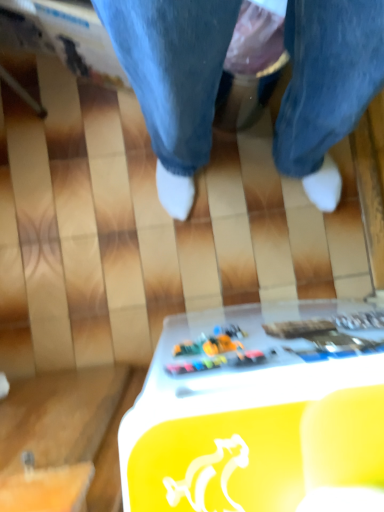
Question: From a real-world perspective, is white plastic table at lower center positioned under metallic gold text at lower center, which is counted as the 2th writing, starting from the left, based on gravity?

Choices:
 (A) no
 (B) yes

Answer: (B)

Question: Can you confirm if white plastic table at lower center is bigger than metallic gold text at lower center, which is counted as the 2th writing, starting from the left?

Choices:
 (A) no
 (B) yes

Answer: (B)

Question: Can you confirm if white plastic table at lower center is taller than metallic gold text at lower center, which is counted as the 2th writing, starting from the left?

Choices:
 (A) no
 (B) yes

Answer: (B)

Question: Does white plastic table at lower center have a lesser width compared to metallic gold text at lower center, which is counted as the 2th writing, starting from the left?

Choices:
 (A) no
 (B) yes

Answer: (A)

Question: Is white plastic table at lower center with metallic gold text at lower center, which is counted as the 2th writing, starting from the left?

Choices:
 (A) no
 (B) yes

Answer: (A)

Question: From a real-world perspective, relative to multicolored plastic toy at center, the second writing from the right, is metallic gold text at lower center, which appears as the first writing when viewed from the right, vertically above or below?

Choices:
 (A) above
 (B) below

Answer: (B)

Question: From the image's perspective, is metallic gold text at lower center, which is counted as the 2th writing, starting from the left, located above or below multicolored plastic toy at center, the second writing from the right?

Choices:
 (A) below
 (B) above

Answer: (B)

Question: Is metallic gold text at lower center, which is counted as the 2th writing, starting from the left, situated inside multicolored plastic toy at center, the second writing from the right, or outside?

Choices:
 (A) outside
 (B) inside

Answer: (B)

Question: Considering their positions, is metallic gold text at lower center, which appears as the first writing when viewed from the right, located in front of or behind multicolored plastic toy at center, which is the 1th writing from left to right?

Choices:
 (A) behind
 (B) front

Answer: (A)

Question: Do you think white plastic table at lower center is within metallic gold text at lower center, which is counted as the 2th writing, starting from the left, or outside of it?

Choices:
 (A) outside
 (B) inside

Answer: (A)

Question: Is point (253, 460) positioned closer to the camera than point (382, 320)?

Choices:
 (A) closer
 (B) farther

Answer: (A)

Question: From the image's perspective, is white plastic table at lower center located above or below metallic gold text at lower center, which appears as the first writing when viewed from the right?

Choices:
 (A) above
 (B) below

Answer: (B)

Question: In terms of size, does white plastic table at lower center appear bigger or smaller than metallic gold text at lower center, which is counted as the 2th writing, starting from the left?

Choices:
 (A) small
 (B) big

Answer: (B)

Question: From the image's perspective, is multicolored plastic toy at center, the second writing from the right, located above or below metallic gold text at lower center, which appears as the first writing when viewed from the right?

Choices:
 (A) below
 (B) above

Answer: (A)

Question: Based on their sizes in the image, would you say multicolored plastic toy at center, the second writing from the right, is bigger or smaller than metallic gold text at lower center, which appears as the first writing when viewed from the right?

Choices:
 (A) small
 (B) big

Answer: (B)